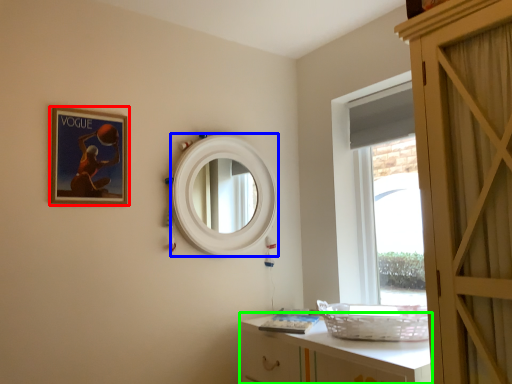
Question: Which object is the farthest from picture frame (highlighted by a red box)? Choose among these: mirror (highlighted by a blue box) or cabinetry (highlighted by a green box).

Choices:
 (A) mirror
 (B) cabinetry

Answer: (B)